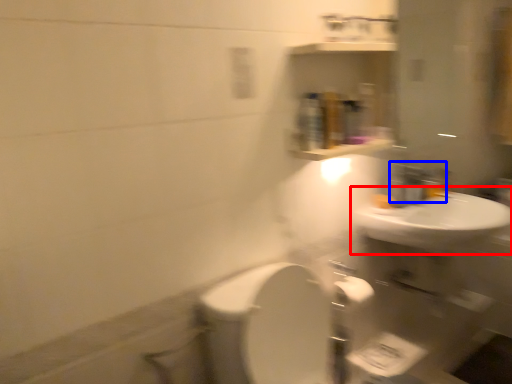
Question: Which of the following is the farthest to the observer, sink (highlighted by a red box) or faucet (highlighted by a blue box)?

Choices:
 (A) sink
 (B) faucet

Answer: (B)